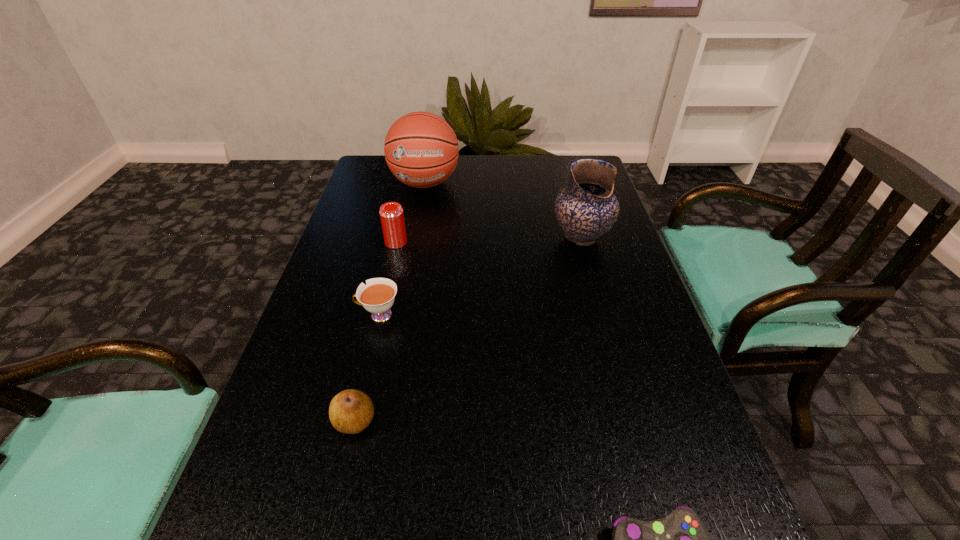
Identify the location of object that is positioned at the far edge. Image resolution: width=960 pixels, height=540 pixels. (421, 149).

The width and height of the screenshot is (960, 540). I want to click on basketball that is at the left edge, so click(421, 149).

Identify the location of beer can situated at the left edge. (391, 213).

What are the coordinates of `pear located at the left edge` in the screenshot? It's located at (351, 411).

The height and width of the screenshot is (540, 960). Find the location of `teacup at the left edge`. teacup at the left edge is located at coordinates (378, 296).

At what (x,y) coordinates should I click in order to perform the action: click on object that is at the right edge. Please return your answer as a coordinate pair (x, y). This screenshot has height=540, width=960. Looking at the image, I should click on (586, 209).

Locate an element on the screen. This screenshot has height=540, width=960. object that is at the far left corner is located at coordinates [421, 149].

Locate an element on the screen. The width and height of the screenshot is (960, 540). free point at the far edge is located at coordinates (524, 163).

The image size is (960, 540). In order to click on vacant area at the left edge of the desktop in this screenshot , I will do `click(275, 512)`.

The width and height of the screenshot is (960, 540). Identify the location of free space at the right edge of the desktop. (657, 355).